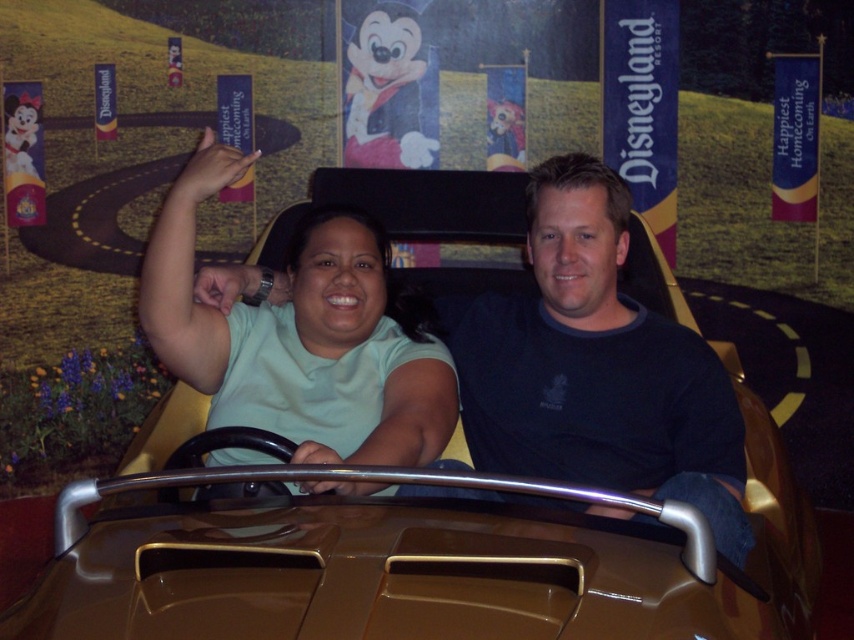
Does dark blue shirt at center have a lesser width compared to matte green shirt at center?

Correct, dark blue shirt at center's width is less than matte green shirt at center's.

Between dark blue shirt at center and matte green shirt at center, which one appears on the right side from the viewer's perspective?

Positioned to the right is dark blue shirt at center.

Who is more distant from viewer, (595,221) or (311,433)?

The point (311,433) is behind.

The height and width of the screenshot is (640, 854). In order to click on dark blue shirt at center in this screenshot , I will do `click(595, 365)`.

Who is higher up, gold metallic car at center or dark blue shirt at center?

Positioned higher is dark blue shirt at center.

Looking at this image, is gold metallic car at center shorter than dark blue shirt at center?

Yes, gold metallic car at center is shorter than dark blue shirt at center.

Is point (300, 627) behind point (477, 301)?

No, (300, 627) is closer to viewer.

The width and height of the screenshot is (854, 640). I want to click on gold metallic car at center, so click(422, 570).

Does point (137, 580) come behind point (161, 310)?

No, (137, 580) is closer to viewer.

Where is `gold metallic car at center`? gold metallic car at center is located at coordinates click(422, 570).